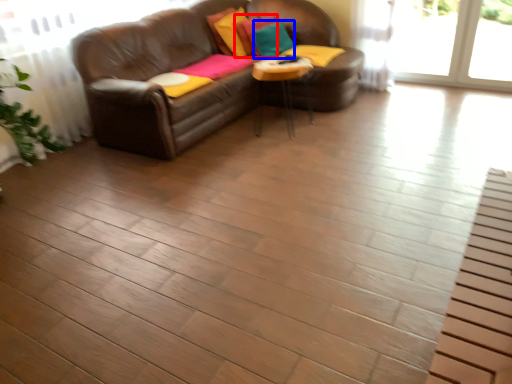
Question: Among these objects, which one is nearest to the camera, pillow (highlighted by a red box) or pillow (highlighted by a blue box)?

Choices:
 (A) pillow
 (B) pillow

Answer: (B)